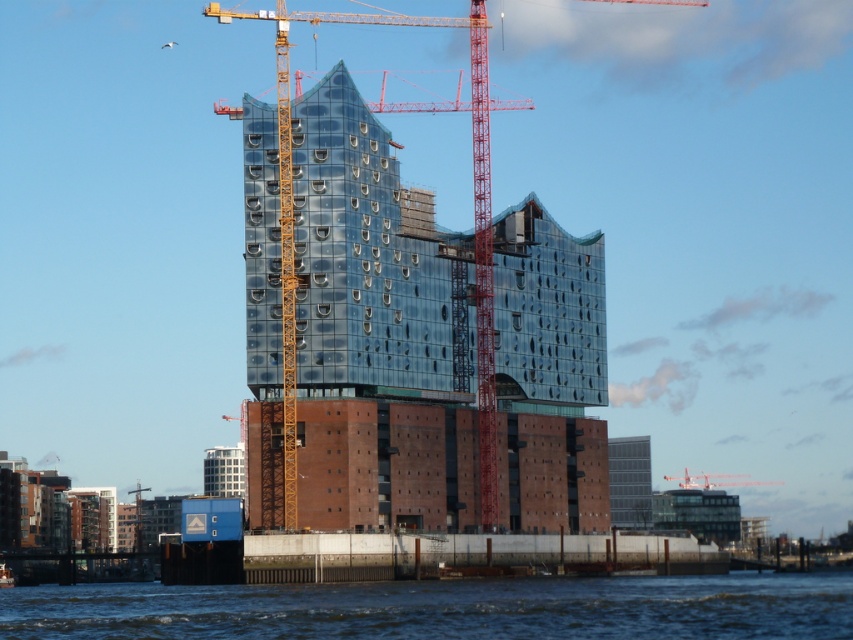
Locate an element on the screen. glassy transparent tower at center is located at coordinates (630, 483).

Does glassy transparent tower at center appear on the right side of metallic red crane at center?

Incorrect, glassy transparent tower at center is not on the right side of metallic red crane at center.

Who is more distant from viewer, [641,470] or [706,484]?

Positioned behind is point [706,484].

In order to click on glassy transparent tower at center in this screenshot , I will do `click(630, 483)`.

Is transparent water at lower center further to the viewer compared to glassy transparent tower at center?

No, it is not.

Is point (419, 596) behind point (640, 442)?

That is False.

Where is `transparent water at lower center`? This screenshot has width=853, height=640. transparent water at lower center is located at coordinates (444, 609).

At what (x,y) coordinates should I click in order to perform the action: click on transparent water at lower center. Please return your answer as a coordinate pair (x, y). Looking at the image, I should click on (444, 609).

Can you confirm if transparent water at lower center is wider than metallic red crane at center?

Yes.

Describe the element at coordinates (444, 609) in the screenshot. I see `transparent water at lower center` at that location.

This screenshot has width=853, height=640. Find the location of `transparent water at lower center`. transparent water at lower center is located at coordinates click(x=444, y=609).